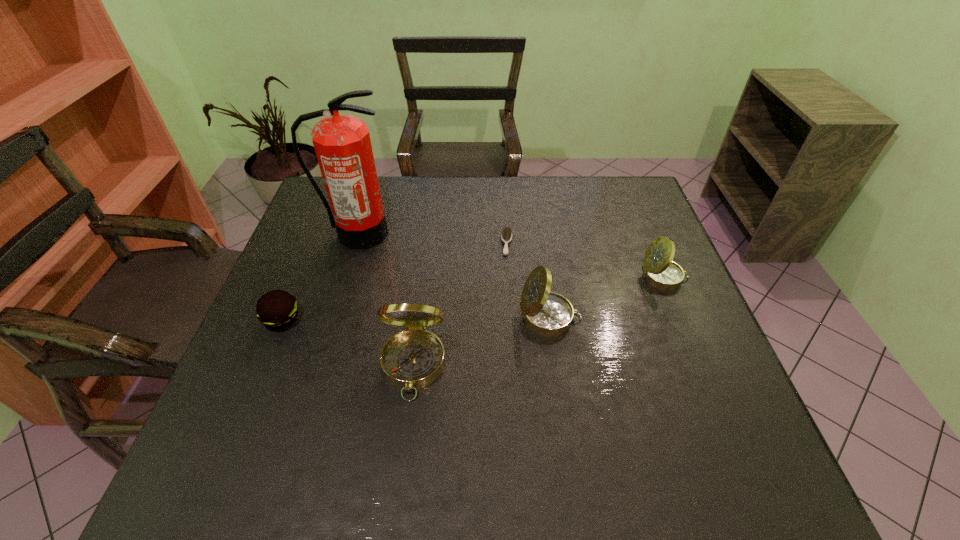
With all compasss evenly spaced, where should an extra compass be placed on the left to continue the pattern? Please point out a vacant space. Please provide its 2D coordinates. Your answer should be formatted as a tuple, i.e. [(x, y)], where the tuple contains the x and y coordinates of a point satisfying the conditions above.

[(246, 425)]